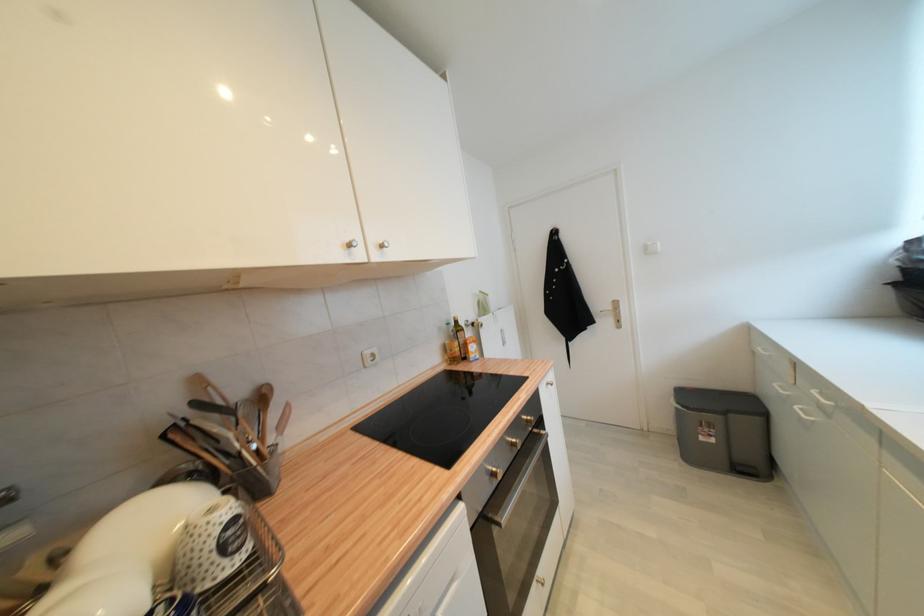
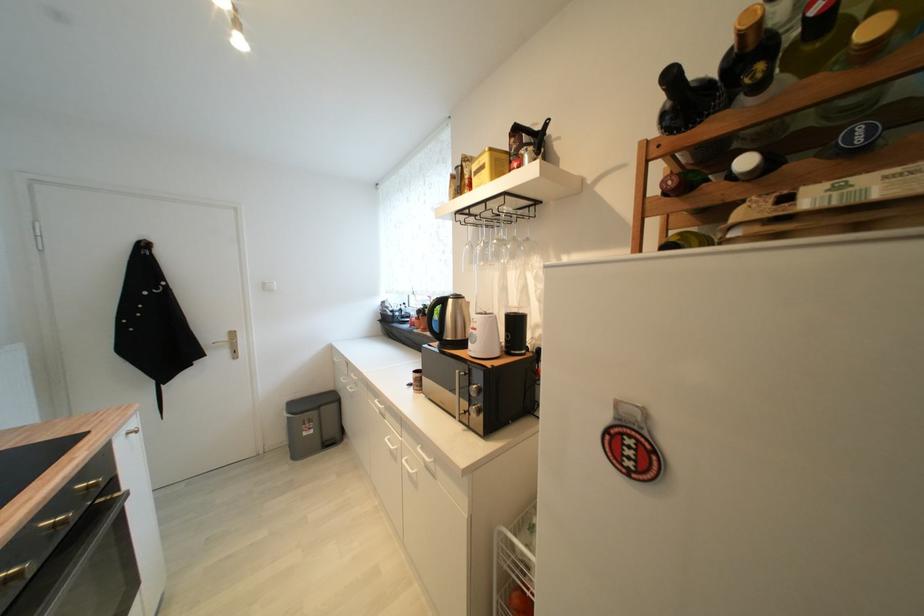
Find the pixel in the second image that matches (707,440) in the first image.

(310, 436)